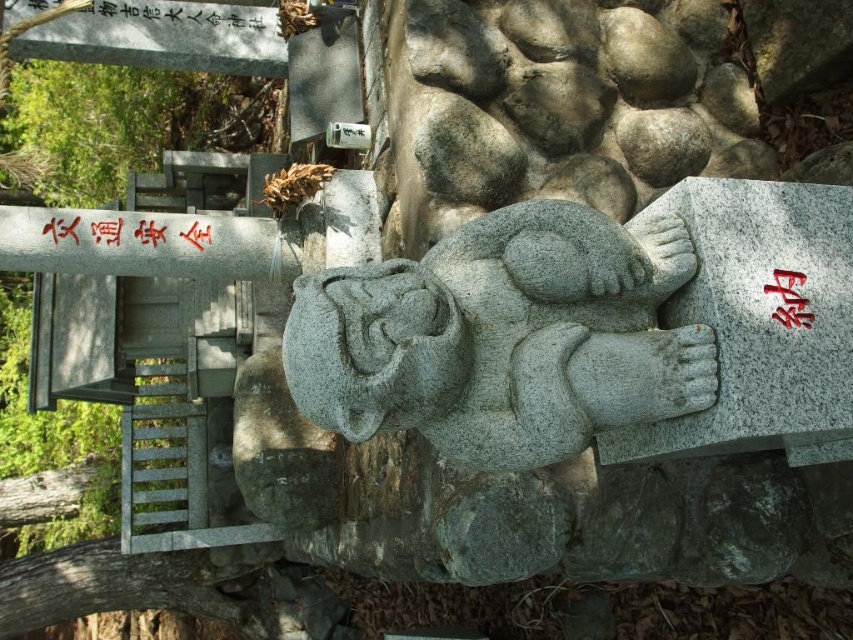
Question: Which point is closer to the camera?

Choices:
 (A) black stone writing at upper center
 (B) red painted stone at center right
 (C) red paper sign at center
 (D) gray stone statue at center

Answer: (D)

Question: Estimate the real-world distances between objects in this image. Which object is farther from the gray stone statue at center?

Choices:
 (A) black stone writing at upper center
 (B) red painted stone at center right
 (C) red paper sign at center

Answer: (A)

Question: Can you confirm if gray stone statue at center is positioned above red paper sign at center?

Choices:
 (A) yes
 (B) no

Answer: (B)

Question: From the image, what is the correct spatial relationship of gray stone statue at center in relation to red paper sign at center?

Choices:
 (A) above
 (B) below

Answer: (B)

Question: Does gray stone statue at center appear on the right side of black stone writing at upper center?

Choices:
 (A) yes
 (B) no

Answer: (A)

Question: Based on their relative distances, which object is farther from the red paper sign at center?

Choices:
 (A) gray stone statue at center
 (B) black stone writing at upper center
 (C) red painted stone at center right

Answer: (C)